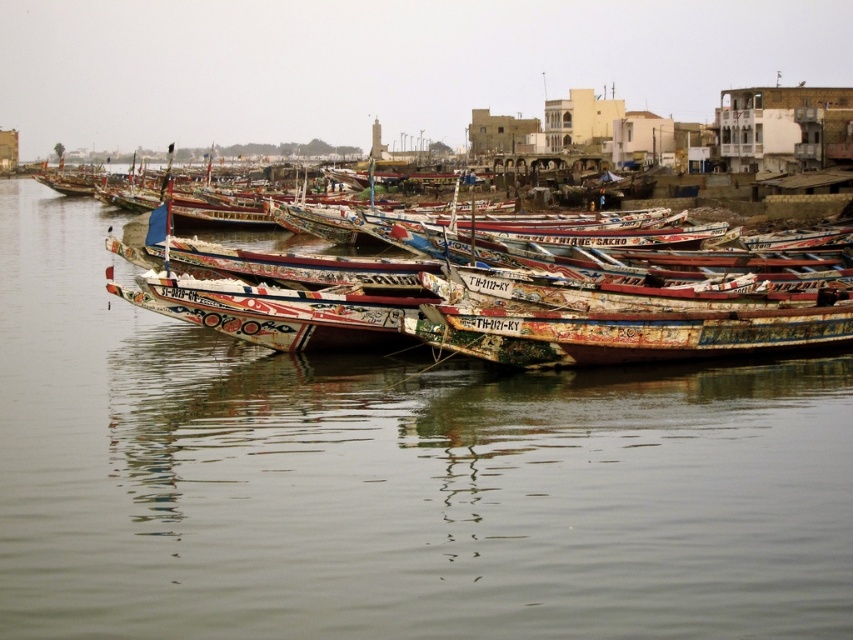
Does point (554, 416) come farther from viewer compared to point (637, 340)?

That is False.

Based on the photo, can you confirm if painted wooden boats at center is shorter than painted wooden boat at center?

Indeed, painted wooden boats at center has a lesser height compared to painted wooden boat at center.

Which is in front, point (215, 497) or point (524, 348)?

Point (215, 497) is more forward.

I want to click on painted wooden boats at center, so click(392, 480).